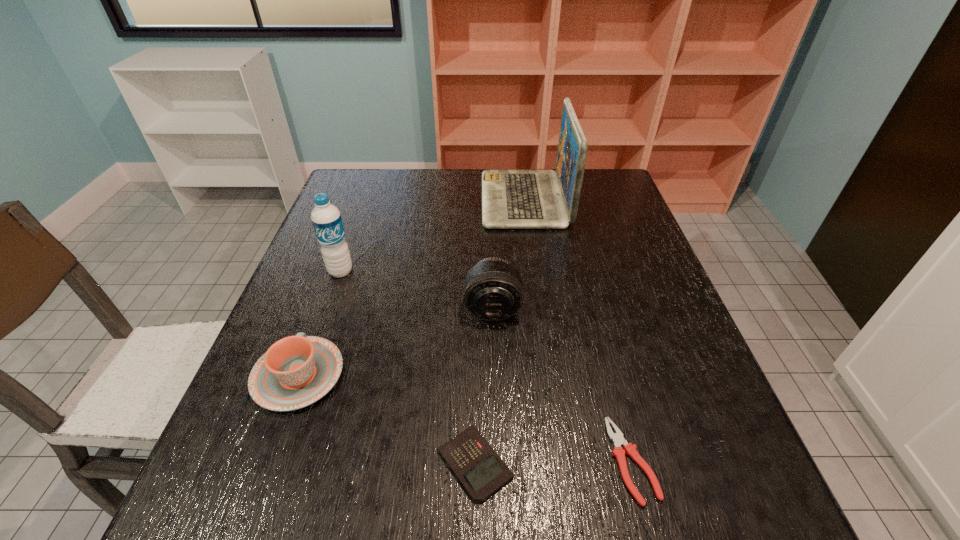
Find the location of `laptop computer`. laptop computer is located at coordinates (511, 199).

Where is `the tallest object`? The image size is (960, 540). the tallest object is located at coordinates (511, 199).

Identify the location of the fifth nearest object. The image size is (960, 540). (326, 218).

What are the coordinates of `water bottle` in the screenshot? It's located at (326, 218).

Where is `telephoto lens`? telephoto lens is located at coordinates (493, 291).

Where is `the fourth shortest object`? Image resolution: width=960 pixels, height=540 pixels. the fourth shortest object is located at coordinates (493, 291).

Where is `the third shortest object`? Image resolution: width=960 pixels, height=540 pixels. the third shortest object is located at coordinates [296, 371].

At what (x,y) coordinates should I click in order to perform the action: click on the third nearest object. Please return your answer as a coordinate pair (x, y). This screenshot has width=960, height=540. Looking at the image, I should click on (296, 371).

I want to click on calculator, so click(x=481, y=471).

Identify the location of pliers. (617, 438).